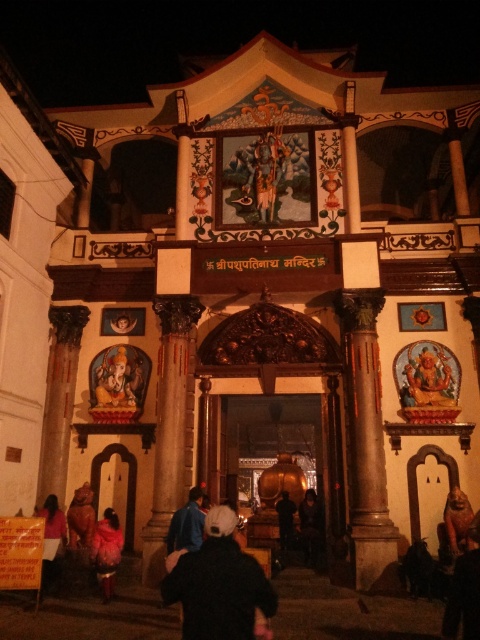
Question: Does golden statue at center have a lesser width compared to matte pink dress at lower left?

Choices:
 (A) yes
 (B) no

Answer: (B)

Question: Which point is closer to the camera taking this photo?

Choices:
 (A) (62, 520)
 (B) (113, 360)

Answer: (A)

Question: Based on their relative distances, which object is farther from the blue fabric jacket at lower left?

Choices:
 (A) black fabric person at center
 (B) golden carved idol at right
 (C) red velvet dress at center
 (D) dark blue fabric at center

Answer: (B)

Question: Does black fabric at center have a smaller size compared to golden statue at center?

Choices:
 (A) yes
 (B) no

Answer: (B)

Question: Observing the image, what is the correct spatial positioning of dark blue fabric at center in reference to matte pink dress at lower left?

Choices:
 (A) right
 (B) left

Answer: (A)

Question: Which object is positioned farthest from the blue fabric jacket at lower left?

Choices:
 (A) red velvet dress at center
 (B) matte pink dress at lower left

Answer: (B)